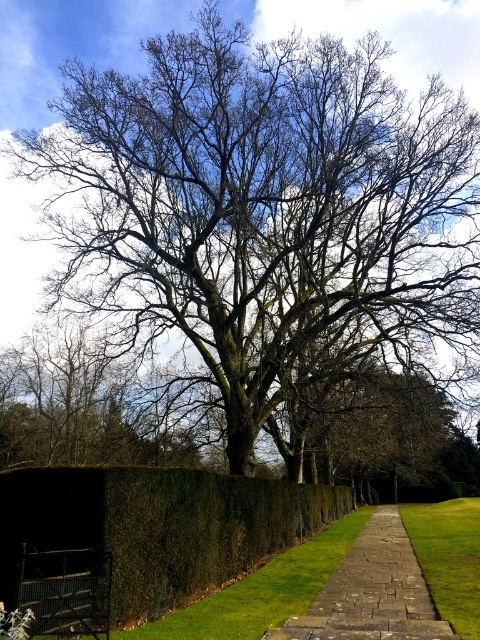
You are standing at the starting point of the pathway and want to walk towards the tree. Which point, point (348, 580) or point (422, 563), would you reach first?

You would reach point (348, 580) first because it is closer to the viewer than point (422, 563).

You are standing at the entrance of the garden and see the green leafy hedge at lower left and the brown stone path at center. Which object is positioned higher relative to the other?

The green leafy hedge at lower left is above the brown stone path at center, so it is positioned higher.